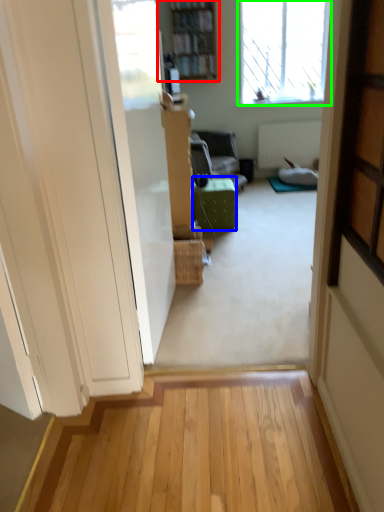
Question: Which object is positioned closest to bookcase (highlighted by a red box)? Select from furniture (highlighted by a blue box) and window (highlighted by a green box).

Choices:
 (A) furniture
 (B) window

Answer: (B)